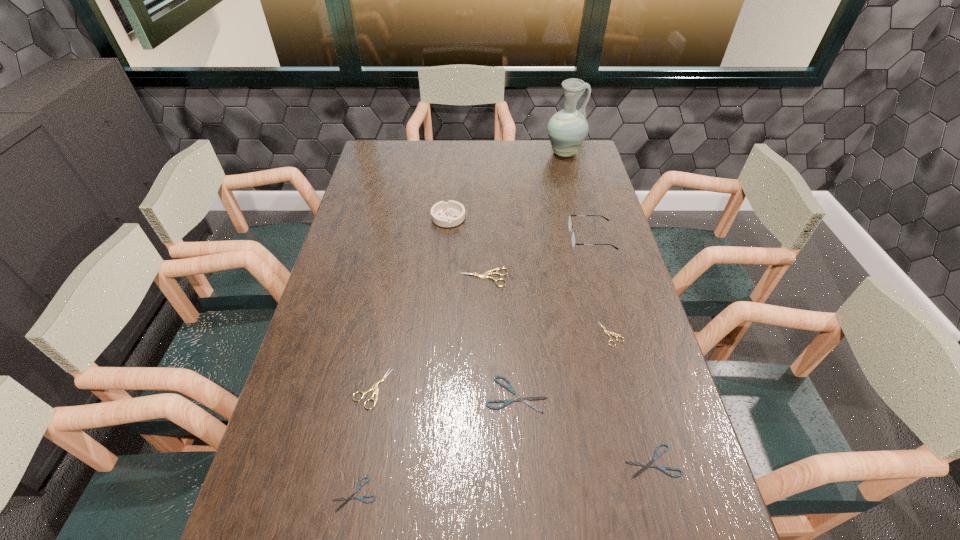
Locate an element on the screen. The height and width of the screenshot is (540, 960). free space between the seventh shortest object and the fifth shortest shears is located at coordinates (410, 303).

The height and width of the screenshot is (540, 960). What are the coordinates of `blank region between the second beige shears from right to left and the farthest black shears` in the screenshot? It's located at (500, 336).

Find the location of a particular element. The image size is (960, 540). the third closest object to the second black shears from left to right is located at coordinates 375,386.

Find the location of a particular element. This screenshot has height=540, width=960. the fourth closest object relative to the nearest beige shears is located at coordinates (650, 464).

At what (x,y) coordinates should I click in order to perform the action: click on shears that is the fourth closest to the second nearest beige shears. Please return your answer as a coordinate pair (x, y). Looking at the image, I should click on (375, 386).

The image size is (960, 540). In order to click on shears that is the fourth closest to the sixth nearest object in this screenshot , I will do `click(650, 464)`.

Select which beige shears is the second closest to the eighth shortest object. Please provide its 2D coordinates. Your answer should be formatted as a tuple, i.e. [(x, y)], where the tuple contains the x and y coordinates of a point satisfying the conditions above.

[(608, 333)]

This screenshot has width=960, height=540. Find the location of `beige shears object that ranks as the third closest to the second tallest object`. beige shears object that ranks as the third closest to the second tallest object is located at coordinates (375, 386).

Find the location of a particular element. the third closest black shears relative to the leftmost beige shears is located at coordinates (650, 464).

Find the location of `black shears object that ranks as the closest to the spectacles`. black shears object that ranks as the closest to the spectacles is located at coordinates (519, 398).